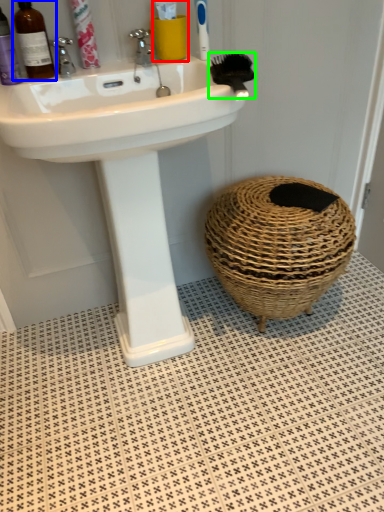
Question: Based on their relative distances, which object is nearer to toiletry (highlighted by a red box)? Choose from mouthwash (highlighted by a blue box) and brush (highlighted by a green box).

Choices:
 (A) mouthwash
 (B) brush

Answer: (B)